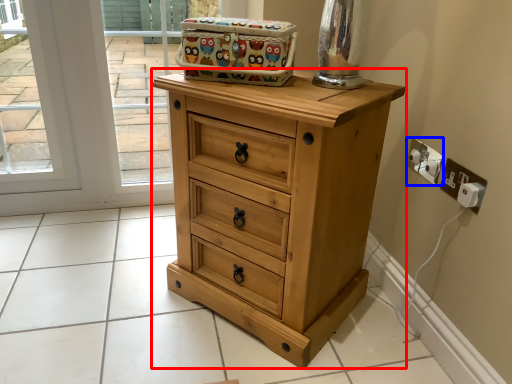
Question: Among these objects, which one is nearest to the camera, chest of drawers (highlighted by a red box) or electric outlet (highlighted by a blue box)?

Choices:
 (A) chest of drawers
 (B) electric outlet

Answer: (A)